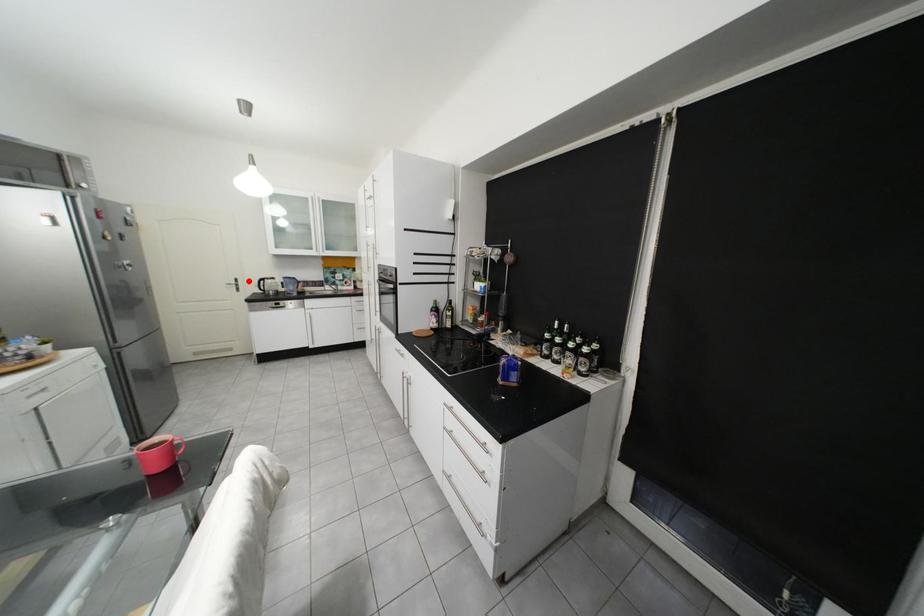
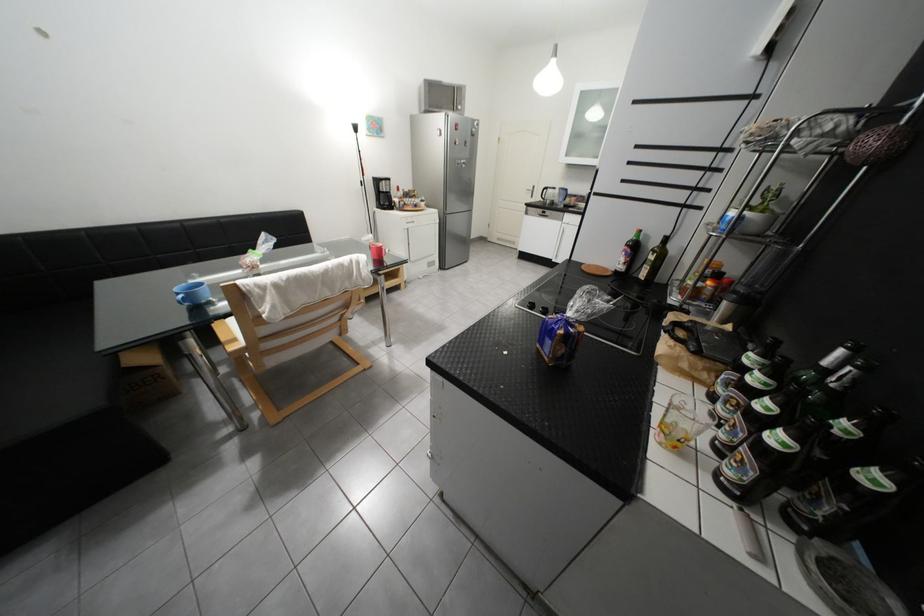
Find the pixel in the second image that matches the highlighted location in the first image.

(545, 188)